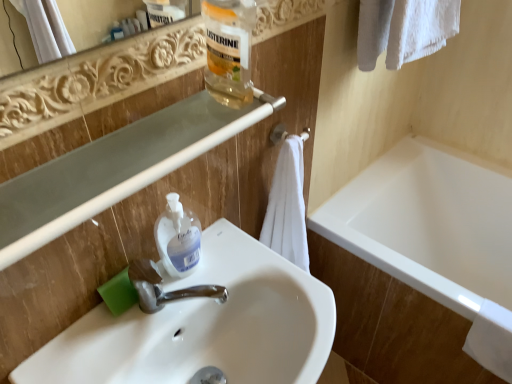
Where is `free point above white glossy sink at center (from a real-world perspective)`? free point above white glossy sink at center (from a real-world perspective) is located at coordinates (190, 307).